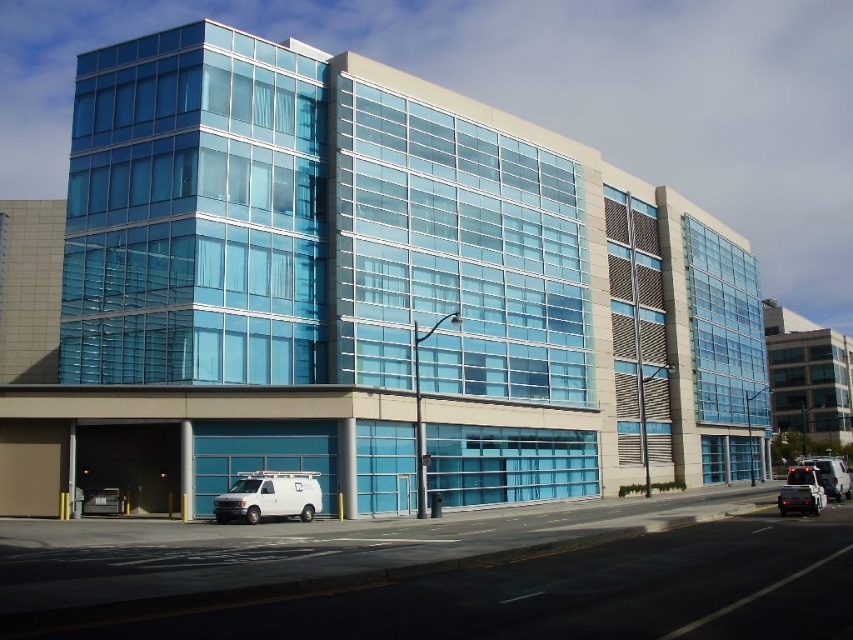
You are a delivery person trying to park your van between the shiny black car at lower right and the metallic silver car at lower right. Based on the scene description, can you fit your van there if the space between them is exactly 1.8 meters?

The shiny black car at lower right is taller than metallic silver car at lower right. However, the question is about the space between them being 1.8 meters. Since the description only mentions height comparison and not the distance between them, we cannot determine if the van can fit based on the provided information.

You are a delivery driver who needs to park your vehicle in the parking lot near the building. You have a truck that is wider than the white matte van at lower center. Can you park your truck in the same spot where the shiny black car at lower right is currently parked?

The white matte van at lower center has a lesser width compared to shiny black car at lower right, which means the shiny black car at lower right is wider. Since your truck is wider than the white matte van at lower center, it might still be possible to park in that spot if the truck is narrower than the shiny black car at lower right. However, without knowing the exact width of your truck relative to the shiny black car at lower right, it is uncertain if it will fit.

You are a delivery person arriving at the building and need to park your vehicle. The parking space available is designed to accommodate vehicles up to the size of the metallic silver car at lower right. Can your white matte van at lower center fit into this space?

The white matte van at lower center is larger than the metallic silver car at lower right. Since the parking space is designed for vehicles up to the size of the metallic silver car at lower right, the white matte van at lower center would not fit into this space.